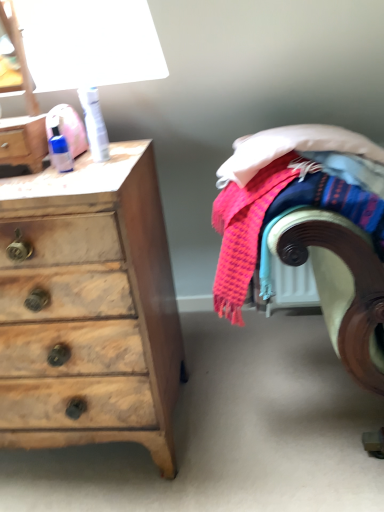
The width and height of the screenshot is (384, 512). I want to click on vacant region to the right of blue plastic bottle at upper left, which is counted as the 2th toiletry, starting from the right, so click(112, 164).